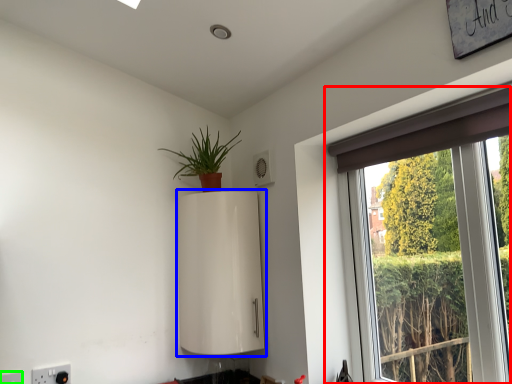
Question: Which object is positioned farthest from window (highlighted by a red box)? Select from appliance (highlighted by a blue box) and electric outlet (highlighted by a green box).

Choices:
 (A) appliance
 (B) electric outlet

Answer: (B)